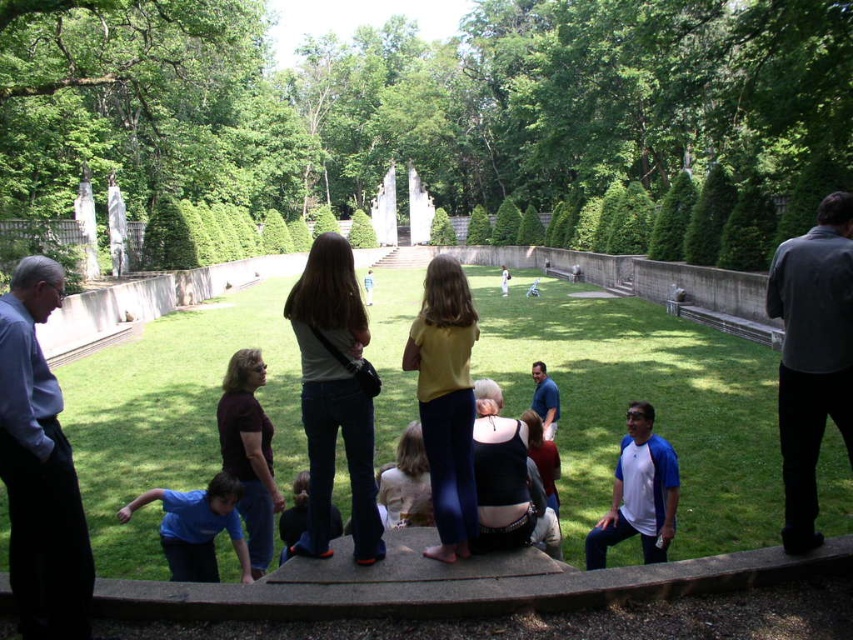
Question: Which of these objects is positioned farthest from the dark blue jeans at lower center?

Choices:
 (A) denim jeans at center
 (B) light blue shirt at left

Answer: (B)

Question: Is denim jeans at center further to the viewer compared to dark blue jeans at lower center?

Choices:
 (A) yes
 (B) no

Answer: (B)

Question: Among these objects, which one is farthest from the camera?

Choices:
 (A) blue shirt at center
 (B) blue cotton shirt at lower center
 (C) dark gray shirt at right
 (D) denim jeans at center

Answer: (A)

Question: Which point appears closest to the camera in this image?

Choices:
 (A) (212, 483)
 (B) (45, 456)
 (C) (537, 412)
 (D) (308, 294)

Answer: (B)

Question: Is blue cotton shirt at lower center positioned before dark blue jeans at lower center?

Choices:
 (A) no
 (B) yes

Answer: (B)

Question: Considering the relative positions of dark gray shirt at right and dark blue jeans at lower center in the image provided, where is dark gray shirt at right located with respect to dark blue jeans at lower center?

Choices:
 (A) left
 (B) right

Answer: (B)